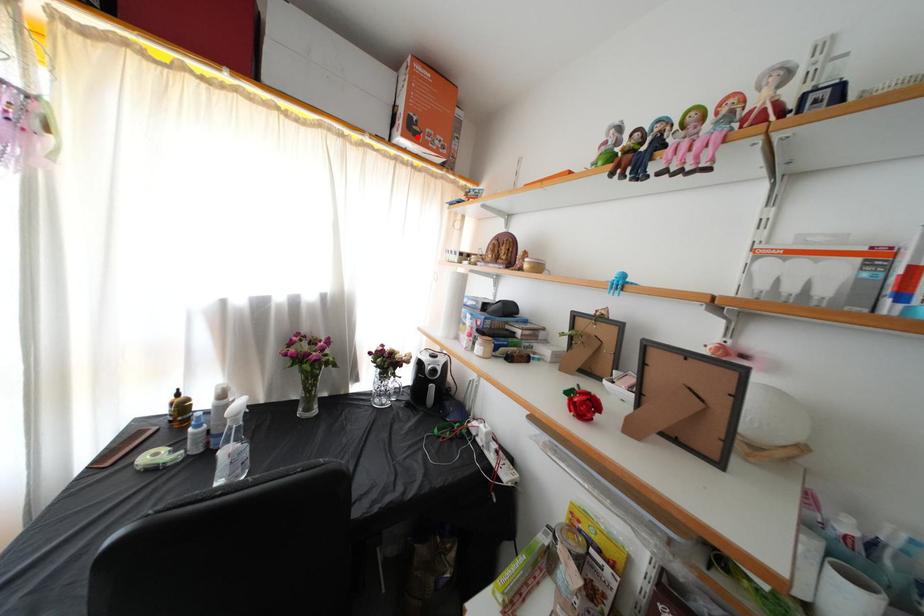
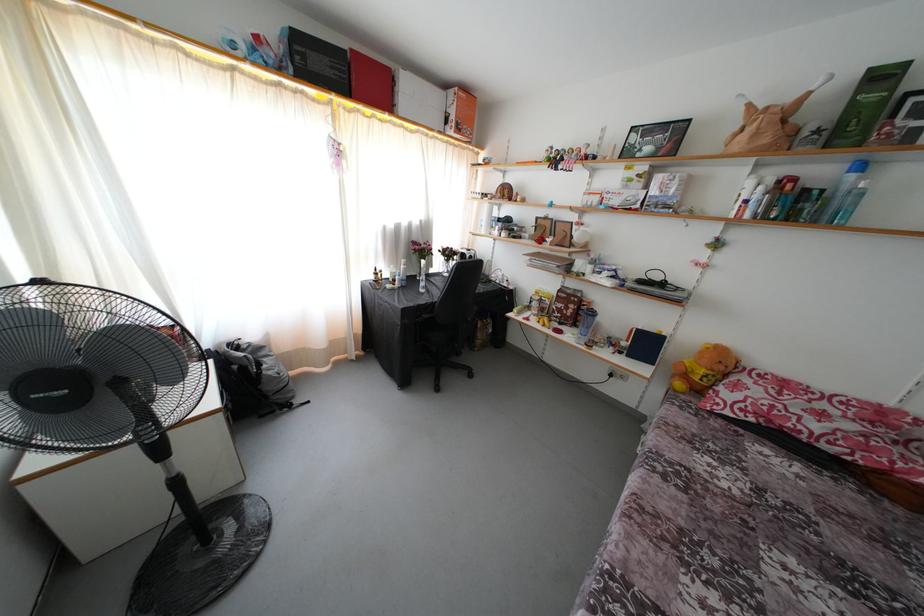
Find the pixel in the second image that matches the highlighted location in the first image.

(463, 134)